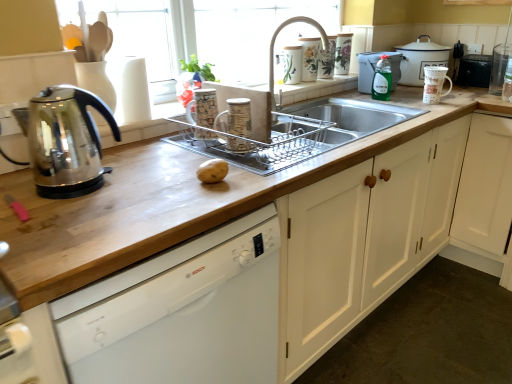
Question: In which direction should I rotate to look at porcelain floral vase at upper center, which is counted as the third appliance, starting from the right?

Choices:
 (A) left
 (B) right

Answer: (B)

Question: Is silver metallic faucet at upper center to the right of porcelain floral mug at upper center, the fifth appliance when ordered from right to left, from the viewer's perspective?

Choices:
 (A) yes
 (B) no

Answer: (B)

Question: From a real-world perspective, is silver metallic faucet at upper center positioned over porcelain floral mug at upper center, the third appliance viewed from the left, based on gravity?

Choices:
 (A) no
 (B) yes

Answer: (B)

Question: Can we say silver metallic faucet at upper center lies outside porcelain floral mug at upper center, the third appliance viewed from the left?

Choices:
 (A) yes
 (B) no

Answer: (A)

Question: Is silver metallic faucet at upper center wider than porcelain floral mug at upper center, the fifth appliance when ordered from right to left?

Choices:
 (A) no
 (B) yes

Answer: (B)

Question: Is silver metallic faucet at upper center smaller than porcelain floral mug at upper center, the fifth appliance when ordered from right to left?

Choices:
 (A) yes
 (B) no

Answer: (B)

Question: Is silver metallic faucet at upper center shorter than porcelain floral mug at upper center, the third appliance viewed from the left?

Choices:
 (A) no
 (B) yes

Answer: (A)

Question: Is transparent glass kettle at left, positioned as the 3th kitchen appliance in back-to-front order, not inside porcelain floral mug at upper center, the third appliance viewed from the left?

Choices:
 (A) no
 (B) yes

Answer: (B)

Question: Is transparent glass kettle at left, the third kitchen appliance when ordered from right to left, positioned in front of porcelain floral mug at upper center, the third appliance viewed from the left?

Choices:
 (A) no
 (B) yes

Answer: (B)

Question: Is transparent glass kettle at left, which appears as the 1th kitchen appliance when ordered from the bottom, beside porcelain floral mug at upper center, the third appliance viewed from the left?

Choices:
 (A) yes
 (B) no

Answer: (B)

Question: Can you confirm if transparent glass kettle at left, the first kitchen appliance in the front-to-back sequence, is bigger than porcelain floral mug at upper center, the third appliance viewed from the left?

Choices:
 (A) no
 (B) yes

Answer: (B)

Question: Considering the relative sizes of transparent glass kettle at left, acting as the 3th kitchen appliance starting from the top, and porcelain floral mug at upper center, the fifth appliance when ordered from right to left, in the image provided, is transparent glass kettle at left, acting as the 3th kitchen appliance starting from the top, taller than porcelain floral mug at upper center, the fifth appliance when ordered from right to left,?

Choices:
 (A) yes
 (B) no

Answer: (A)

Question: Could you tell me if transparent glass kettle at left, the first kitchen appliance in the left-to-right sequence, is facing porcelain floral mug at upper center, the fifth appliance when ordered from right to left?

Choices:
 (A) yes
 (B) no

Answer: (B)

Question: Is brown matte potato at center not inside white enamel pot at upper right, positioned as the first kitchen appliance in right-to-left order?

Choices:
 (A) no
 (B) yes

Answer: (B)